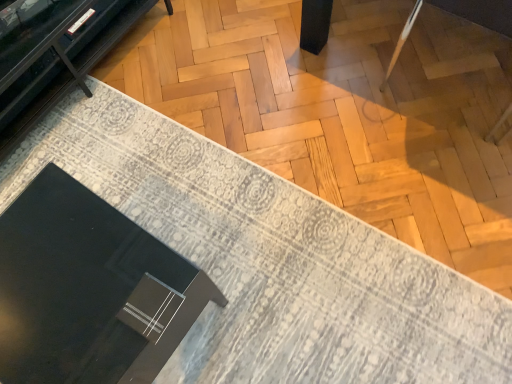
Question: Is black glossy round table at lower left bigger or smaller than matte black tv stand at upper left?

Choices:
 (A) small
 (B) big

Answer: (A)

Question: Considering the positions of black glossy round table at lower left and matte black tv stand at upper left in the image, is black glossy round table at lower left taller or shorter than matte black tv stand at upper left?

Choices:
 (A) short
 (B) tall

Answer: (B)

Question: Based on their relative distances, which object is nearer to the black glossy round table at lower left?

Choices:
 (A) matte black box at lower left
 (B) matte black tv stand at upper left

Answer: (B)

Question: Estimate the real-world distances between objects in this image. Which object is farther from the matte black box at lower left?

Choices:
 (A) black glossy round table at lower left
 (B) matte black tv stand at upper left

Answer: (A)